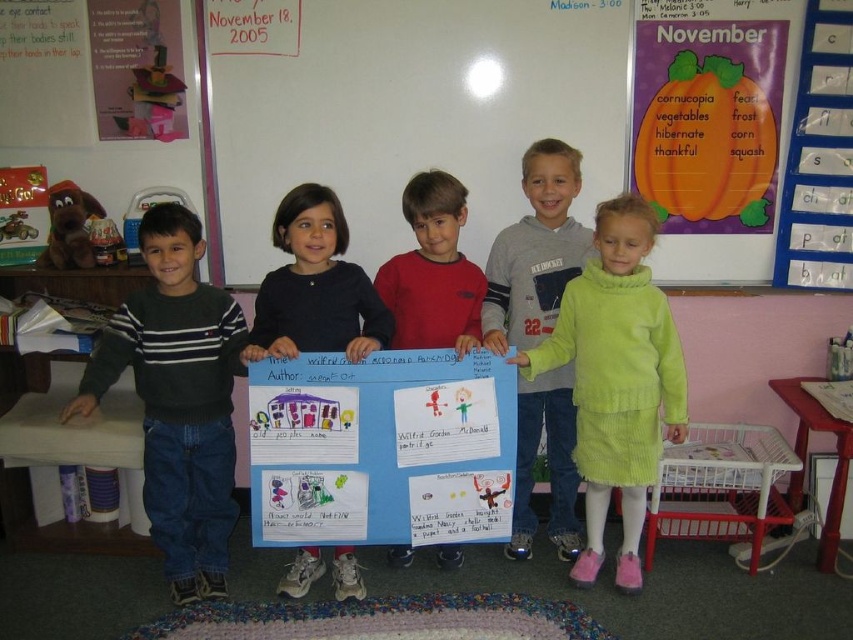
Question: Is green corduroy dress at center above light green sweater at center?

Choices:
 (A) yes
 (B) no

Answer: (B)

Question: Based on their relative distances, which object is nearer to the dark green sweater at left?

Choices:
 (A) red sweater at center
 (B) light green sweater at center
 (C) green corduroy dress at center

Answer: (A)

Question: Is the position of dark green sweater at left less distant than that of light green sweater at center?

Choices:
 (A) no
 (B) yes

Answer: (B)

Question: Which point appears farthest from the camera in this image?

Choices:
 (A) (422, 284)
 (B) (538, 154)

Answer: (B)

Question: Is dark green sweater at left smaller than light green sweater at center?

Choices:
 (A) yes
 (B) no

Answer: (B)

Question: Which object is positioned farthest from the light green sweater at center?

Choices:
 (A) black sweater at center
 (B) green corduroy dress at center

Answer: (A)